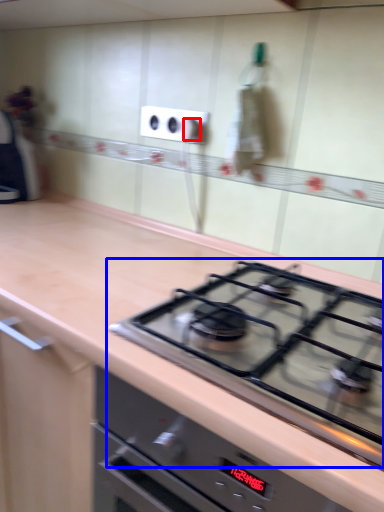
Question: Among these objects, which one is farthest to the camera, knob (highlighted by a red box) or gas stove (highlighted by a blue box)?

Choices:
 (A) knob
 (B) gas stove

Answer: (A)